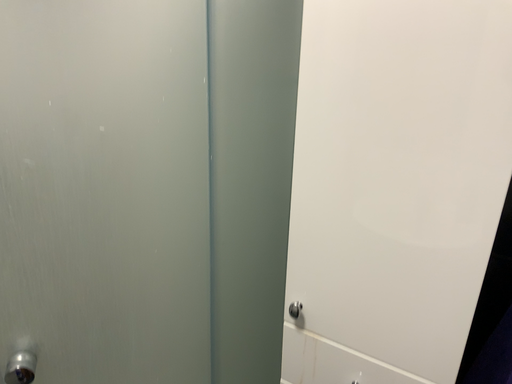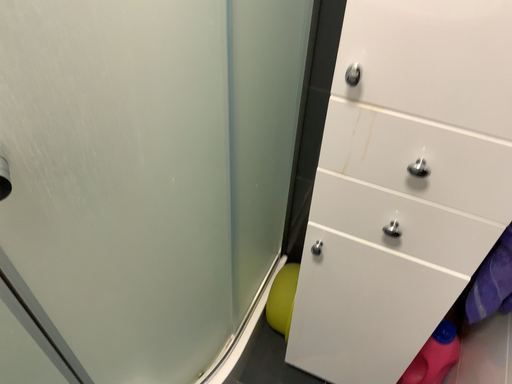
Question: How did the camera likely rotate when shooting the video?

Choices:
 (A) rotated upward
 (B) rotated downward

Answer: (B)